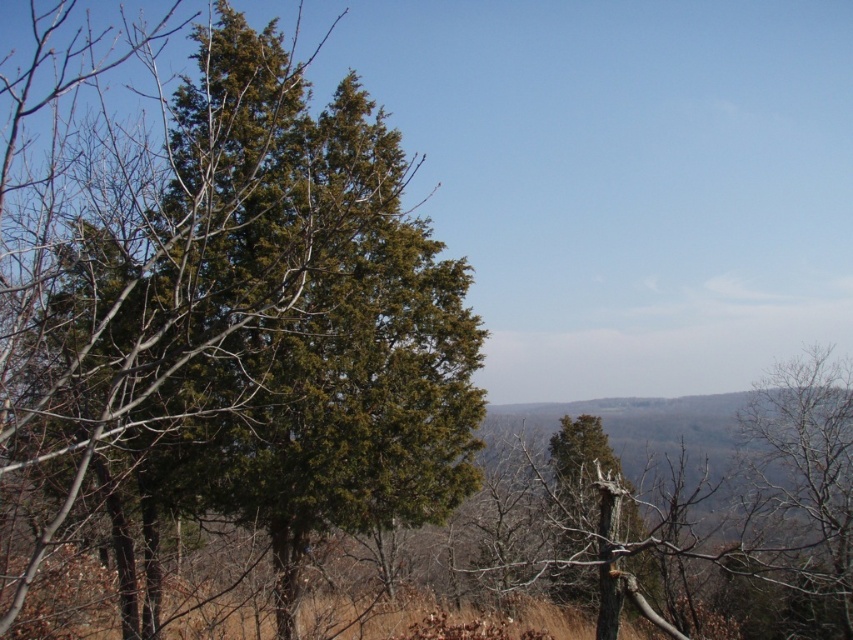
Question: Which point appears farthest from the camera in this image?

Choices:
 (A) (683, 458)
 (B) (160, 285)

Answer: (A)

Question: Is green needle-like tree at left positioned in front of green leafy tree at center?

Choices:
 (A) no
 (B) yes

Answer: (B)

Question: Is green needle-like tree at left below green leafy tree at center?

Choices:
 (A) no
 (B) yes

Answer: (A)

Question: Does green needle-like tree at left have a larger size compared to green leafy tree at center?

Choices:
 (A) no
 (B) yes

Answer: (A)

Question: Among these points, which one is farthest from the camera?

Choices:
 (A) (421, 312)
 (B) (523, 554)

Answer: (B)